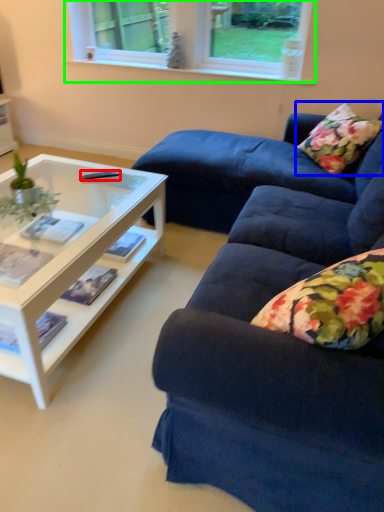
Question: Considering the real-world distances, which object is farthest from remote control (highlighted by a red box)? pillow (highlighted by a blue box) or window (highlighted by a green box)?

Choices:
 (A) pillow
 (B) window

Answer: (B)